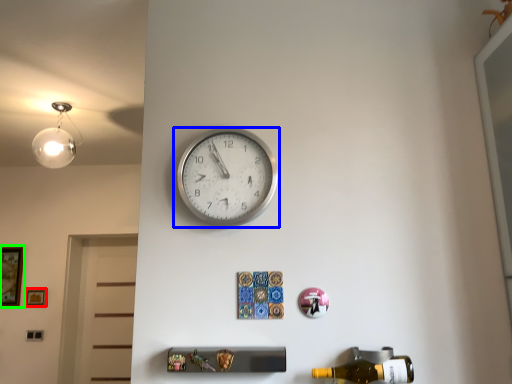
Question: Which is nearer to the picture frame (highlighted by a red box)? wall clock (highlighted by a blue box) or picture frame (highlighted by a green box).

Choices:
 (A) wall clock
 (B) picture frame

Answer: (B)